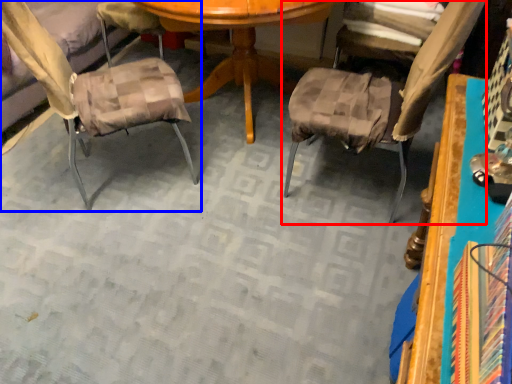
Question: Which of the following is the farthest to the observer, chair (highlighted by a red box) or chair (highlighted by a blue box)?

Choices:
 (A) chair
 (B) chair

Answer: (B)